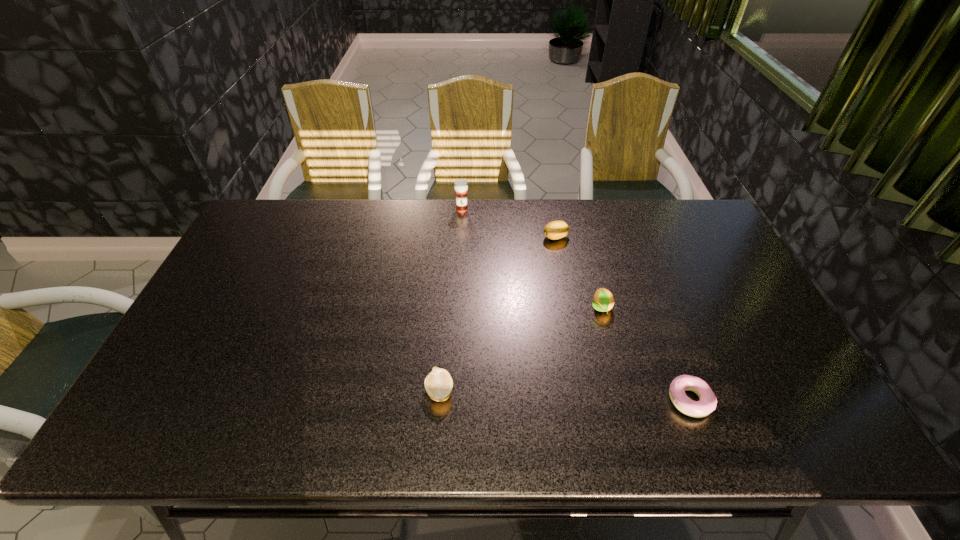
Find the location of `free space located 0.160m at the stem end of the second lemon from right to left`. free space located 0.160m at the stem end of the second lemon from right to left is located at coordinates (494, 237).

Find the location of a particular element. The width and height of the screenshot is (960, 540). blank space located 0.110m at the stem end of the second lemon from right to left is located at coordinates (510, 237).

Identify the location of vacant space located at the stem end of the second lemon from right to left. Image resolution: width=960 pixels, height=540 pixels. (503, 237).

The image size is (960, 540). I want to click on vacant point located with leaves positioned above the third nearest object, so click(x=614, y=360).

The width and height of the screenshot is (960, 540). In order to click on vacant region located on the back of the rightmost object in this screenshot , I will do `click(670, 348)`.

This screenshot has width=960, height=540. I want to click on vacant space located on the left of the shortest lemon, so click(263, 392).

Find the location of a particular element. This screenshot has height=540, width=960. medicine that is at the far edge is located at coordinates (460, 186).

Where is `lemon that is at the far edge`? lemon that is at the far edge is located at coordinates (557, 229).

The height and width of the screenshot is (540, 960). Find the location of `object that is at the near edge`. object that is at the near edge is located at coordinates (707, 402).

Locate an element on the screen. The image size is (960, 540). vacant space at the far edge of the desktop is located at coordinates (650, 218).